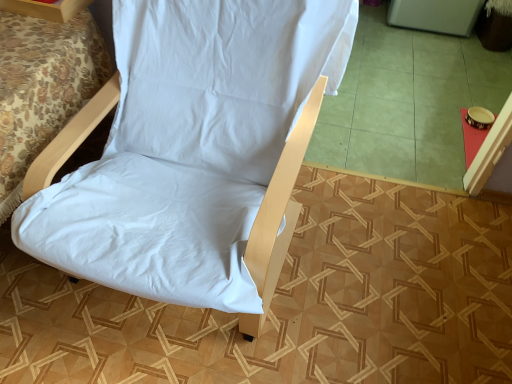
The height and width of the screenshot is (384, 512). In order to click on vacant area that is situated to the right of white fabric chair at center in this screenshot , I will do `click(386, 267)`.